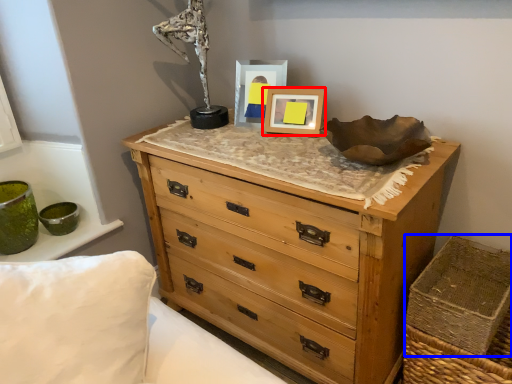
Question: Among these objects, which one is farthest to the camera, picture frame (highlighted by a red box) or crate (highlighted by a blue box)?

Choices:
 (A) picture frame
 (B) crate

Answer: (A)